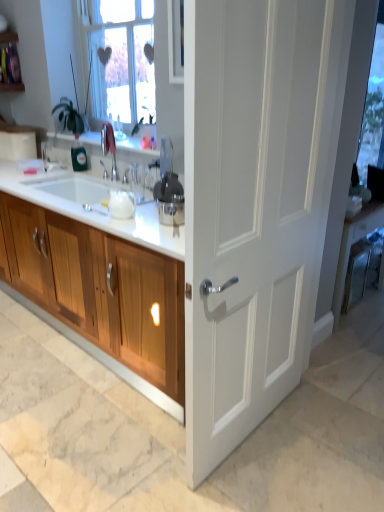
Image resolution: width=384 pixels, height=512 pixels. What are the coordinates of `free region under white matte door at center (from a real-world perspective)` in the screenshot? It's located at (249, 437).